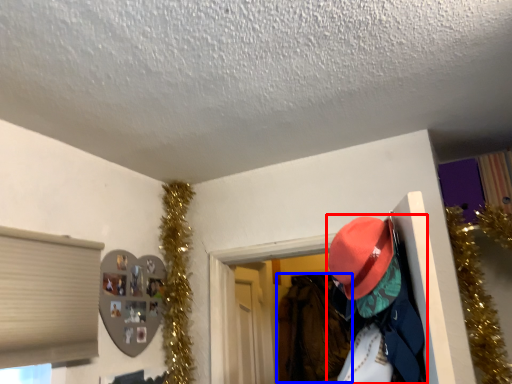
Question: Which point is closer to the camera, person (highlighted by a red box) or clothing (highlighted by a blue box)?

Choices:
 (A) person
 (B) clothing

Answer: (A)